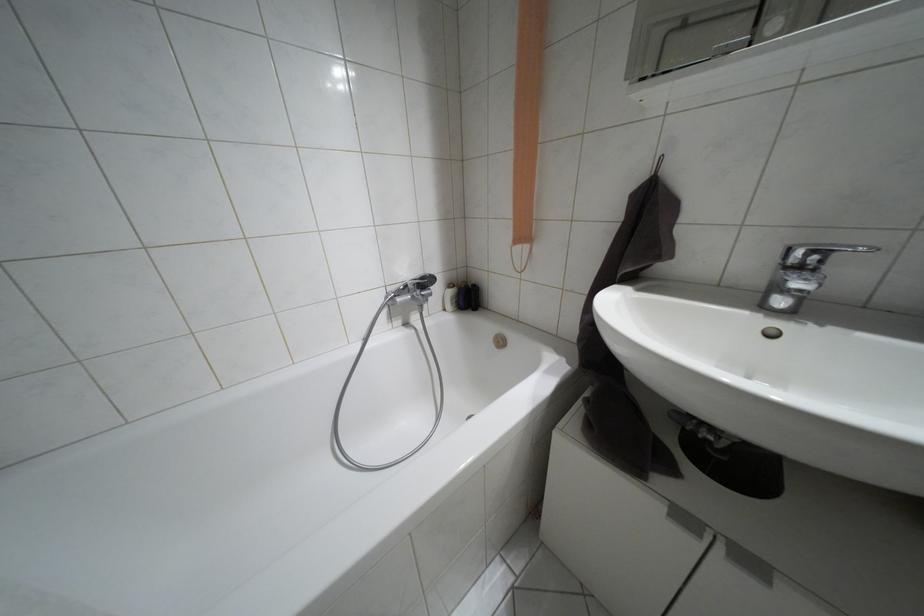
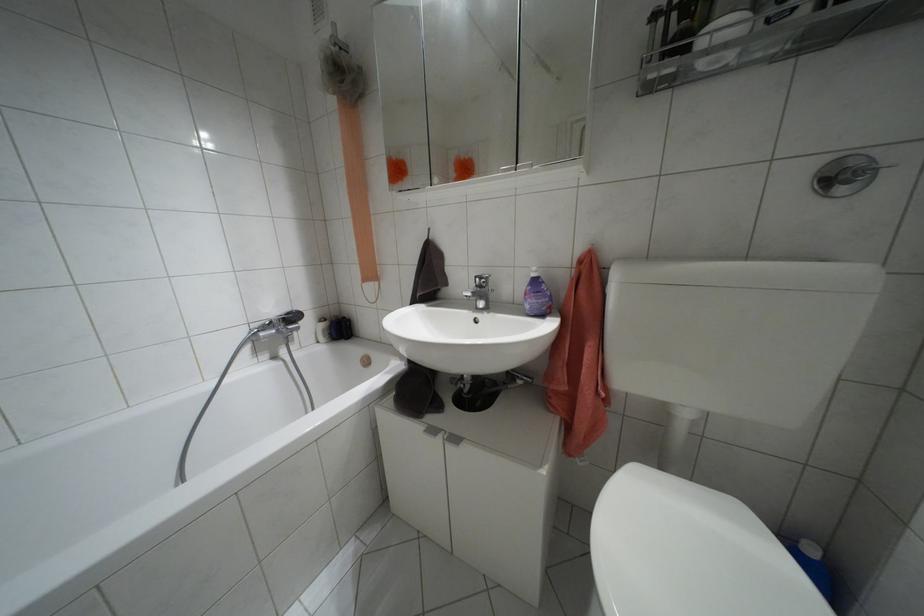
In the second image, find the point that corresponds to point 797,269 in the first image.

(479, 286)